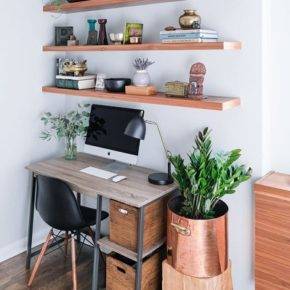
Image resolution: width=290 pixels, height=290 pixels. Identify the location of copper pot. (216, 253).